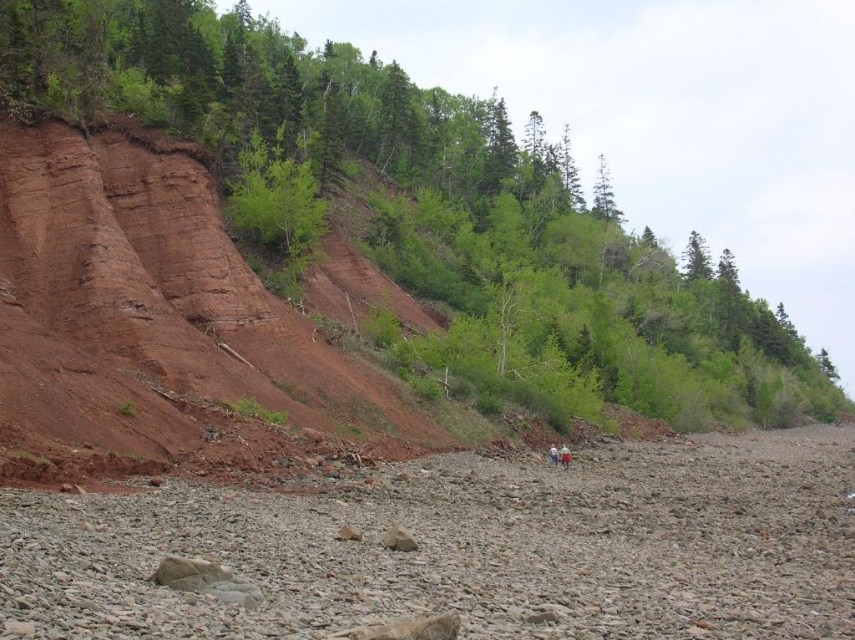
Question: Does reddish-brown dirt at upper left lie behind light blue denim jeans at lower center?

Choices:
 (A) no
 (B) yes

Answer: (A)

Question: Does gray gravelly shore at lower center have a larger size compared to light blue denim jeans at lower center?

Choices:
 (A) yes
 (B) no

Answer: (A)

Question: Which object is the closest to the light blue denim jeans at center?

Choices:
 (A) green leafy tree at upper center
 (B) gray gravelly shore at lower center
 (C) light blue denim jeans at lower center

Answer: (C)

Question: Which point is closer to the camera taking this photo?

Choices:
 (A) (728, 525)
 (B) (522, 225)
 (C) (134, 387)
 (D) (567, 460)

Answer: (A)

Question: Which of the following is the farthest from the observer?

Choices:
 (A) (287, 609)
 (B) (534, 307)

Answer: (B)

Question: Does reddish-brown dirt at upper left have a greater width compared to light blue denim jeans at lower center?

Choices:
 (A) no
 (B) yes

Answer: (B)